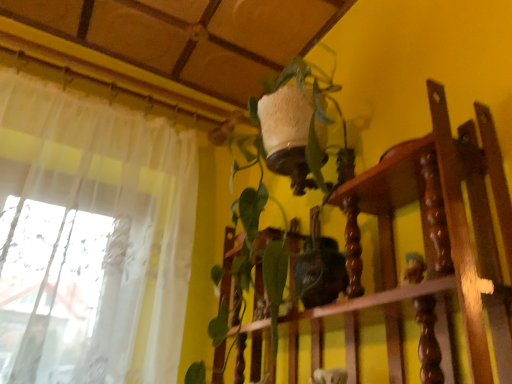
Question: Is green matte plant at center thinner than white textured vase at upper center?

Choices:
 (A) no
 (B) yes

Answer: (A)

Question: Is white textured vase at upper center at the back of green matte plant at center?

Choices:
 (A) no
 (B) yes

Answer: (B)

Question: Does green matte plant at center come in front of white textured vase at upper center?

Choices:
 (A) no
 (B) yes

Answer: (A)

Question: From the image's perspective, is green matte plant at center below white textured vase at upper center?

Choices:
 (A) yes
 (B) no

Answer: (B)

Question: Could you tell me if green matte plant at center is turned towards white textured vase at upper center?

Choices:
 (A) yes
 (B) no

Answer: (A)

Question: Considering the relative positions of green matte plant at center and white textured vase at upper center in the image provided, is green matte plant at center to the right of white textured vase at upper center from the viewer's perspective?

Choices:
 (A) yes
 (B) no

Answer: (B)

Question: Considering the relative sizes of white textured vase at upper center and green matte plant at center in the image provided, is white textured vase at upper center wider than green matte plant at center?

Choices:
 (A) yes
 (B) no

Answer: (B)

Question: Does white textured vase at upper center touch green matte plant at center?

Choices:
 (A) no
 (B) yes

Answer: (A)

Question: Does white textured vase at upper center lie in front of green matte plant at center?

Choices:
 (A) no
 (B) yes

Answer: (B)

Question: Does white textured vase at upper center come behind green matte plant at center?

Choices:
 (A) yes
 (B) no

Answer: (B)

Question: From the image's perspective, is white textured vase at upper center above green matte plant at center?

Choices:
 (A) yes
 (B) no

Answer: (B)

Question: Would you say white textured vase at upper center contains green matte plant at center?

Choices:
 (A) no
 (B) yes

Answer: (B)

Question: From their relative heights in the image, would you say green matte plant at center is taller or shorter than white textured vase at upper center?

Choices:
 (A) tall
 (B) short

Answer: (A)